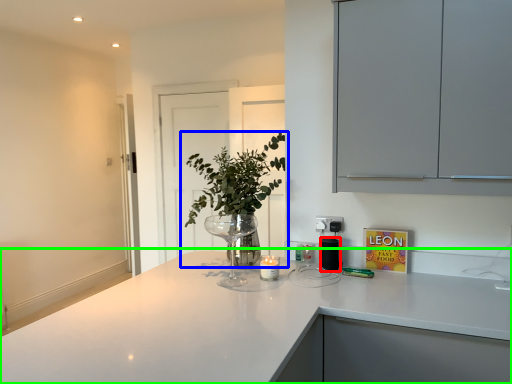
Question: Which is nearer to the appliance (highlighted by a red box)? houseplant (highlighted by a blue box) or countertop (highlighted by a green box).

Choices:
 (A) houseplant
 (B) countertop

Answer: (A)